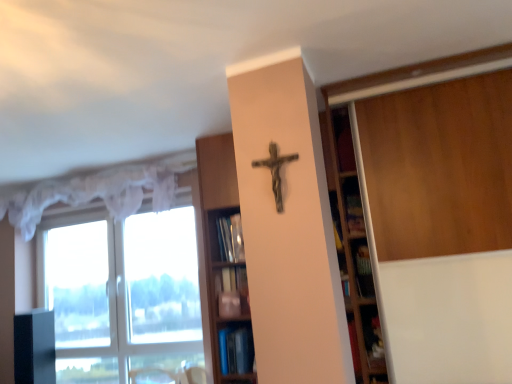
Question: In terms of size, does black glossy cabinet at left appear bigger or smaller than white sheer curtain at upper left?

Choices:
 (A) big
 (B) small

Answer: (B)

Question: Considering the positions of black glossy cabinet at left and white sheer curtain at upper left in the image, is black glossy cabinet at left taller or shorter than white sheer curtain at upper left?

Choices:
 (A) tall
 (B) short

Answer: (A)

Question: Based on their relative distances, which object is farther from the blue glossy bookshelf at lower center, placed as the 1th shelf when sorted from bottom to top?

Choices:
 (A) white sheer curtain at upper left
 (B) rusty metal crucifix at center
 (C) wooden bookshelf at center, the second shelf from the bottom
 (D) black glossy cabinet at left
 (E) transparent glass window at left

Answer: (D)

Question: Estimate the real-world distances between objects in this image. Which object is farther from the transparent glass window at left?

Choices:
 (A) wooden bookshelf at center, the second shelf from the bottom
 (B) white sheer curtain at upper left
 (C) blue glossy bookshelf at lower center, placed as the second shelf when sorted from top to bottom
 (D) black glossy cabinet at left
 (E) rusty metal crucifix at center

Answer: (E)